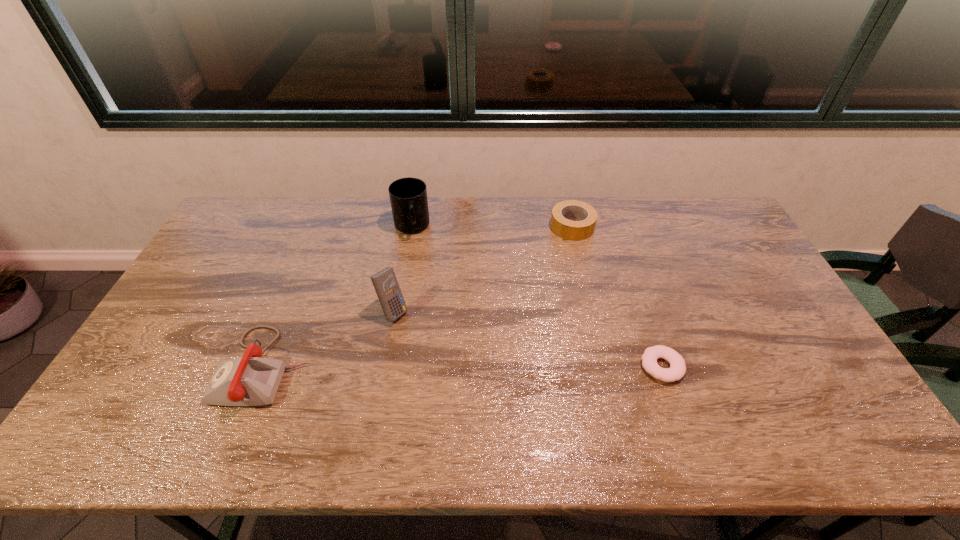
Locate an element on the screen. This screenshot has height=540, width=960. telephone is located at coordinates (250, 380).

The height and width of the screenshot is (540, 960). Identify the location of the leftmost object. (250, 380).

Where is `doughnut`? The image size is (960, 540). doughnut is located at coordinates (677, 369).

Locate an element on the screen. Image resolution: width=960 pixels, height=540 pixels. the shortest object is located at coordinates (677, 369).

At what (x,y) coordinates should I click in order to perform the action: click on the fourth tallest object. Please return your answer as a coordinate pair (x, y). This screenshot has width=960, height=540. Looking at the image, I should click on (587, 215).

You are a GUI agent. You are given a task and a screenshot of the screen. Output one action in this format:
    pyautogui.click(x=<x>, y=<y>)
    Task: Click on the duct tape
    This screenshot has width=960, height=540.
    Given the screenshot: What is the action you would take?
    pyautogui.click(x=587, y=215)

Where is `mug`? This screenshot has width=960, height=540. mug is located at coordinates (408, 196).

Where is `the third farthest object`? Image resolution: width=960 pixels, height=540 pixels. the third farthest object is located at coordinates click(385, 282).

Where is `vacant space located on the dial of the third tallest object`? This screenshot has width=960, height=540. vacant space located on the dial of the third tallest object is located at coordinates (158, 367).

Locate an element on the screen. free location located on the dial of the third tallest object is located at coordinates (173, 367).